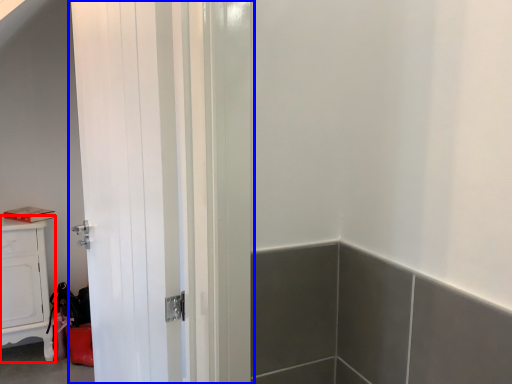
Question: Among these objects, which one is farthest to the camera, cabinetry (highlighted by a red box) or door (highlighted by a blue box)?

Choices:
 (A) cabinetry
 (B) door

Answer: (A)